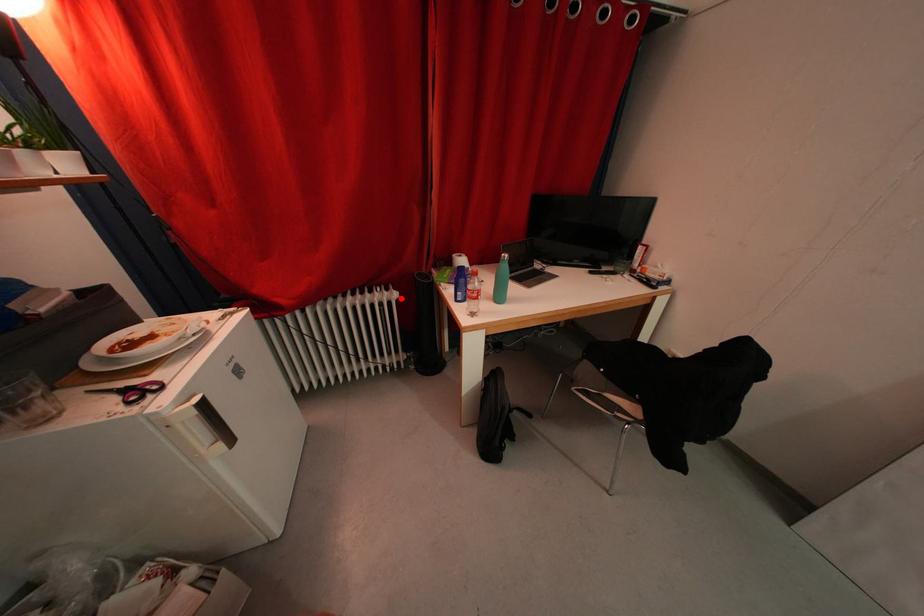
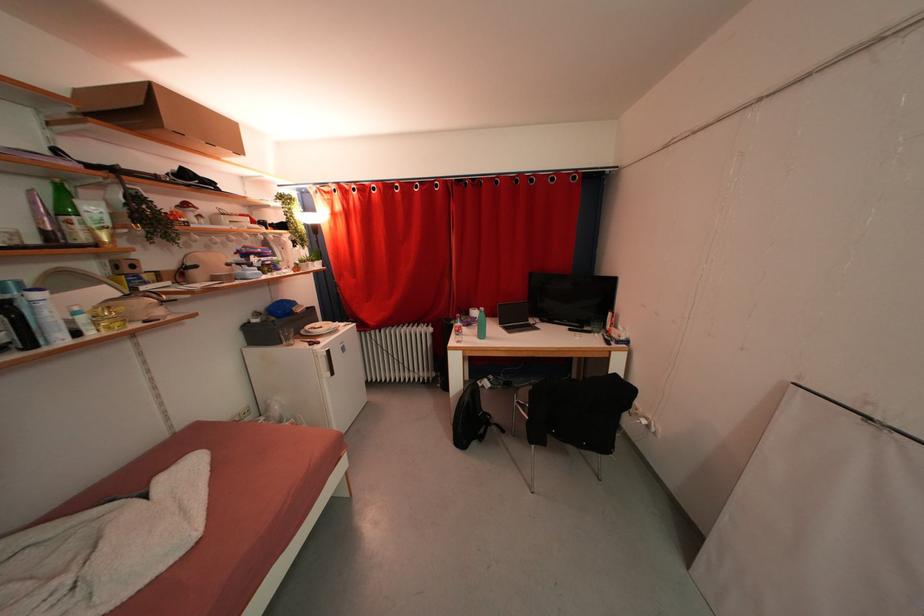
Question: I am providing you with two images of the same scene from different viewpoints. Image1 has a red point marked. In image2, the corresponding 3D location appears at what relative position? Reply with the corresponding letter.

Choices:
 (A) Closer
 (B) Farther

Answer: (B)